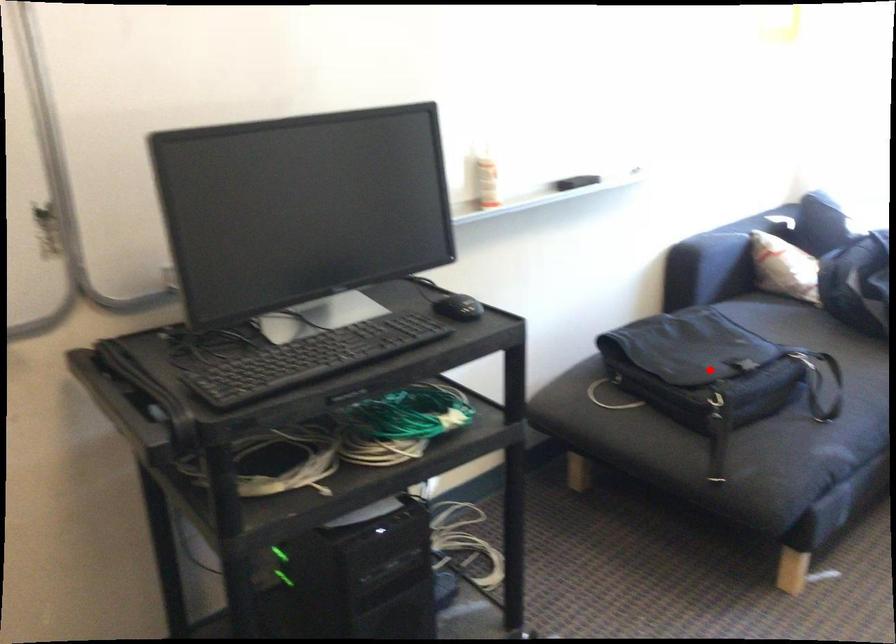
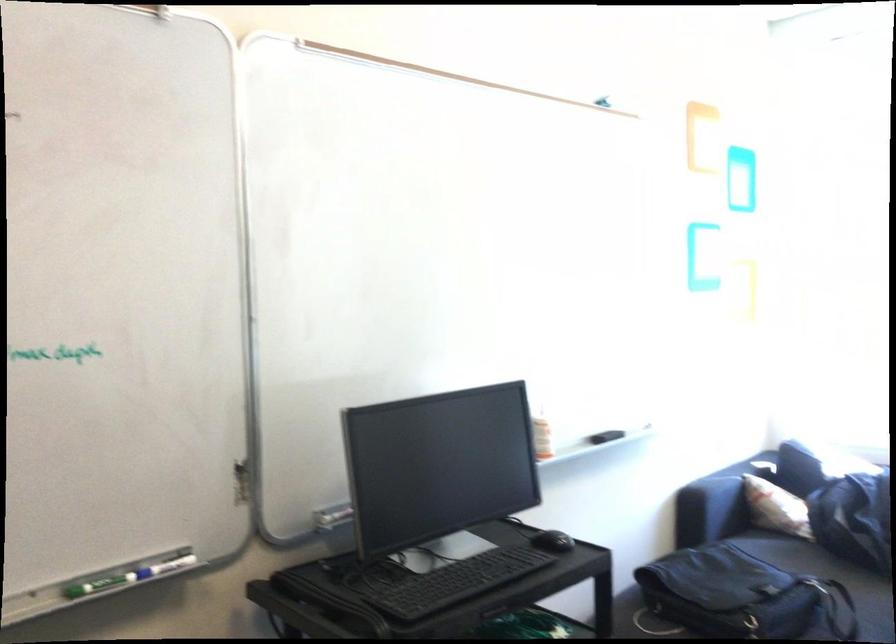
The point at the highlighted location is marked in the first image. Where is the corresponding point in the second image?

(744, 596)